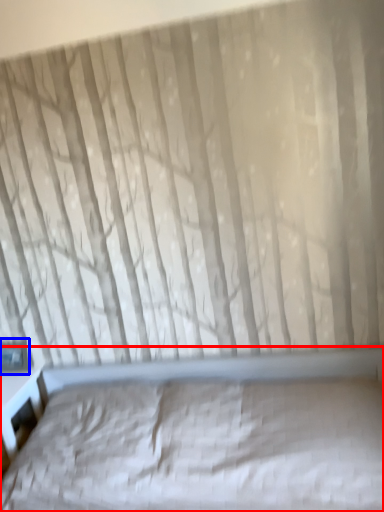
Question: Which point is further to the camera, bed (highlighted by a red box) or window (highlighted by a blue box)?

Choices:
 (A) bed
 (B) window

Answer: (B)